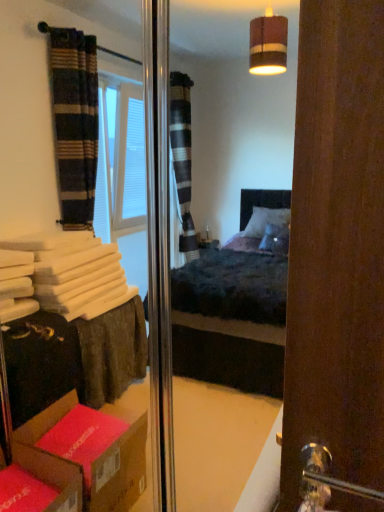
Question: Is silver metallic door handle at lower right bigger than cardboard box at lower left?

Choices:
 (A) yes
 (B) no

Answer: (B)

Question: From a real-world perspective, does silver metallic door handle at lower right sit lower than cardboard box at lower left?

Choices:
 (A) yes
 (B) no

Answer: (B)

Question: Does silver metallic door handle at lower right lie behind cardboard box at lower left?

Choices:
 (A) yes
 (B) no

Answer: (B)

Question: Is silver metallic door handle at lower right taller than cardboard box at lower left?

Choices:
 (A) no
 (B) yes

Answer: (B)

Question: Can you confirm if silver metallic door handle at lower right is wider than cardboard box at lower left?

Choices:
 (A) no
 (B) yes

Answer: (A)

Question: From the image's perspective, is silver metallic door handle at lower right above cardboard box at lower left?

Choices:
 (A) yes
 (B) no

Answer: (A)

Question: From a real-world perspective, is cardboard box at lower left located higher than silver metallic door handle at lower right?

Choices:
 (A) no
 (B) yes

Answer: (A)

Question: Can you confirm if cardboard box at lower left is thinner than silver metallic door handle at lower right?

Choices:
 (A) yes
 (B) no

Answer: (B)

Question: Could you tell me if cardboard box at lower left is facing silver metallic door handle at lower right?

Choices:
 (A) no
 (B) yes

Answer: (A)

Question: Considering the relative sizes of cardboard box at lower left and silver metallic door handle at lower right in the image provided, is cardboard box at lower left taller than silver metallic door handle at lower right?

Choices:
 (A) no
 (B) yes

Answer: (A)

Question: From the image's perspective, is cardboard box at lower left on silver metallic door handle at lower right?

Choices:
 (A) yes
 (B) no

Answer: (B)

Question: Considering the relative positions of cardboard box at lower left and silver metallic door handle at lower right in the image provided, is cardboard box at lower left behind silver metallic door handle at lower right?

Choices:
 (A) yes
 (B) no

Answer: (A)

Question: Is silver metallic door handle at lower right inside or outside of cardboard box at lower left?

Choices:
 (A) outside
 (B) inside

Answer: (A)